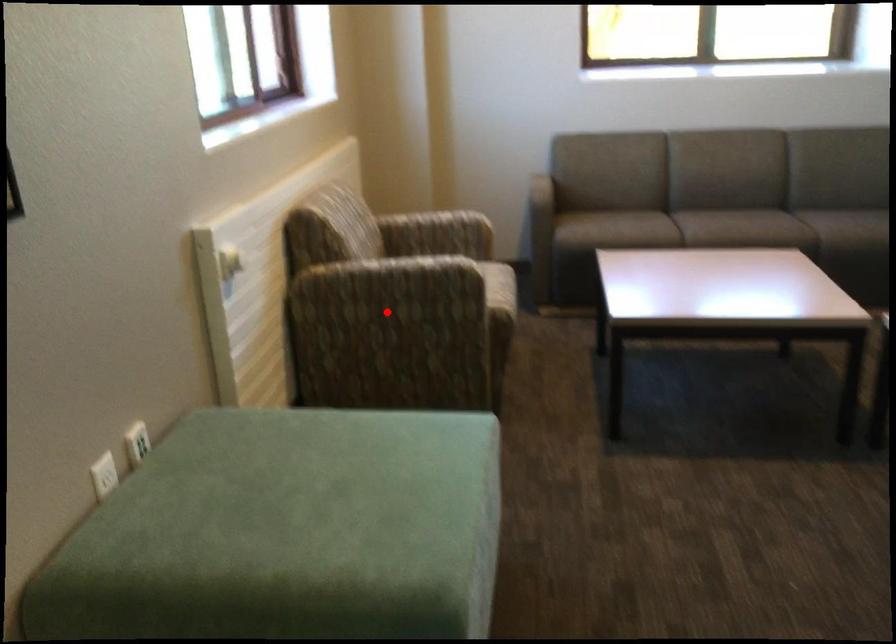
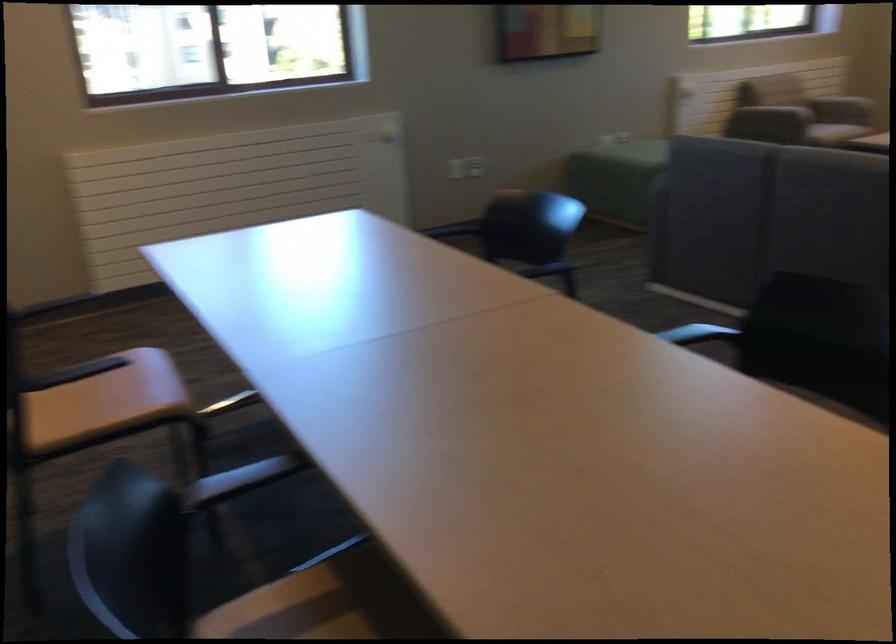
Question: I am providing you with two images of the same scene from different viewpoints. A red point is marked on the first image. Can you still see the location of the red point in image 2?

Choices:
 (A) Yes
 (B) No

Answer: (B)